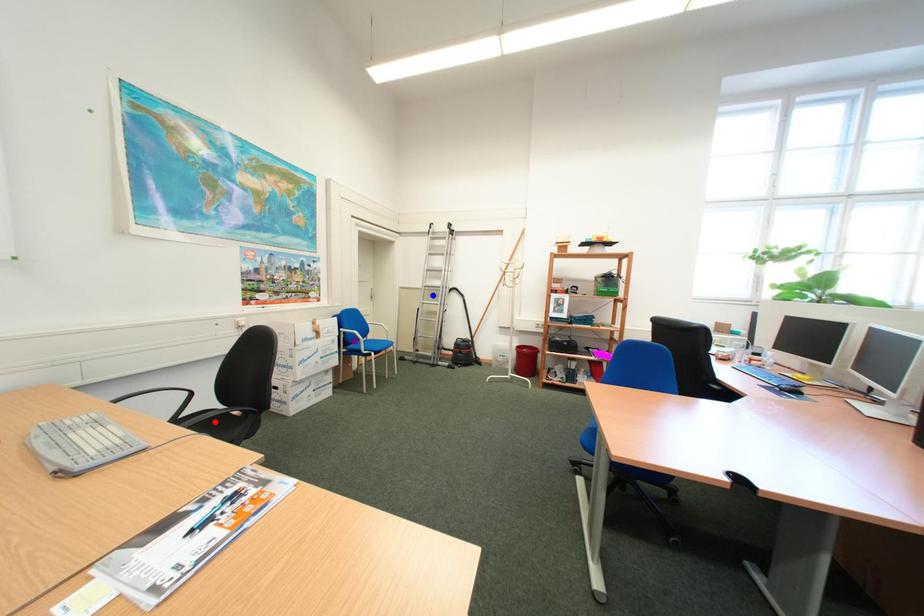
Order these from nearest to farthest:
A) purple point
B) red point
C) blue point

red point → purple point → blue point